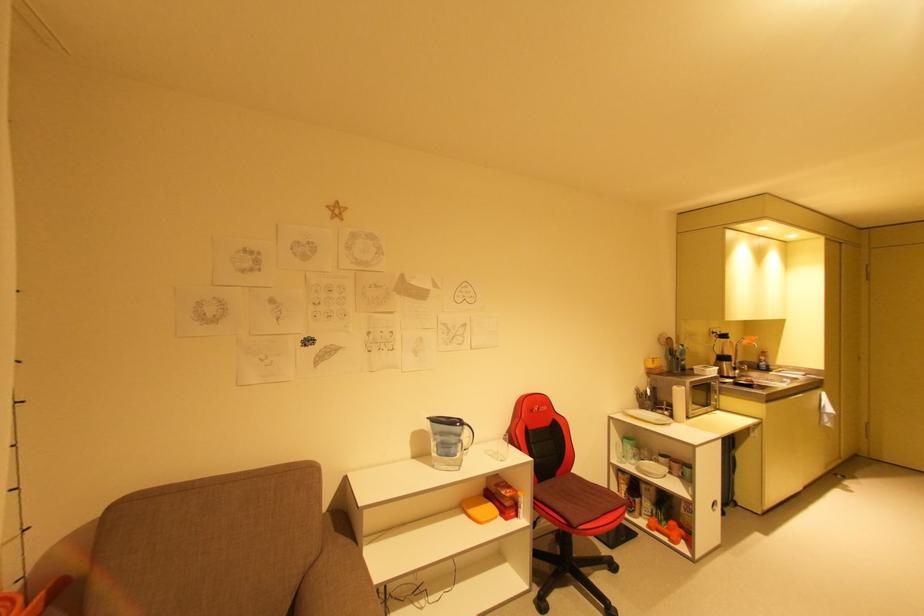
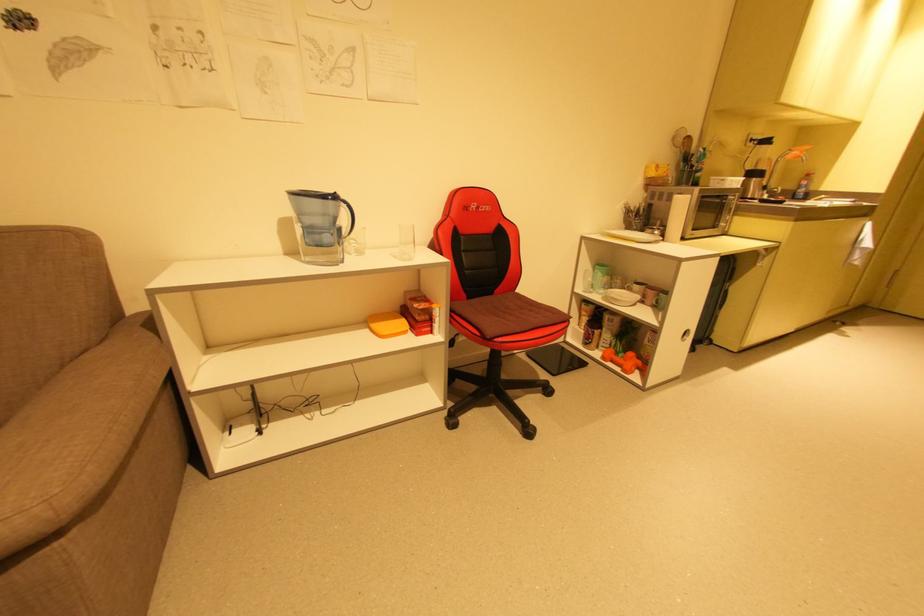
Where in the second image is the point corresponding to pixel 497 458 from the first image?

(400, 257)